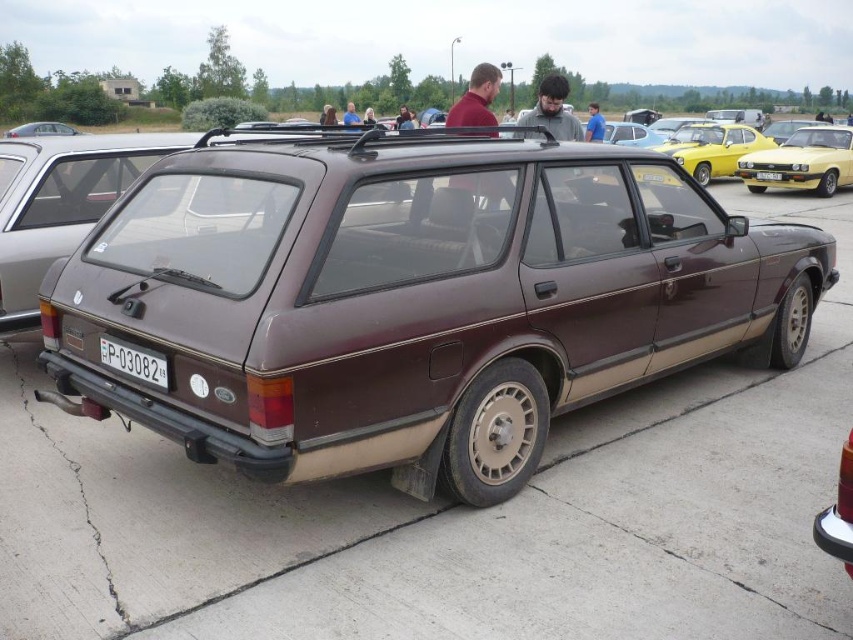
From the picture: Who is more forward, (810,168) or (125,349)?

Point (125,349)

Does yellow metallic car at right have a greater width compared to white plastic license plate at bottom center?

Yes, yellow metallic car at right is wider than white plastic license plate at bottom center.

This screenshot has width=853, height=640. What are the coordinates of `yellow metallic car at right` in the screenshot? It's located at (804, 161).

Measure the distance from yellow glossy car at upper right to brown matte station wagon at center.

yellow glossy car at upper right is 28.02 meters from brown matte station wagon at center.

Measure the distance between yellow glossy car at upper right and camera.

yellow glossy car at upper right and camera are 17.83 meters apart from each other.

This screenshot has width=853, height=640. I want to click on yellow glossy car at upper right, so click(712, 147).

Where is `yellow glossy car at upper right`? This screenshot has width=853, height=640. yellow glossy car at upper right is located at coordinates (712, 147).

Who is shorter, yellow glossy car at upper right or white plastic license plate at bottom center?

Standing shorter between the two is white plastic license plate at bottom center.

Identify the location of yellow glossy car at upper right. This screenshot has width=853, height=640. (712, 147).